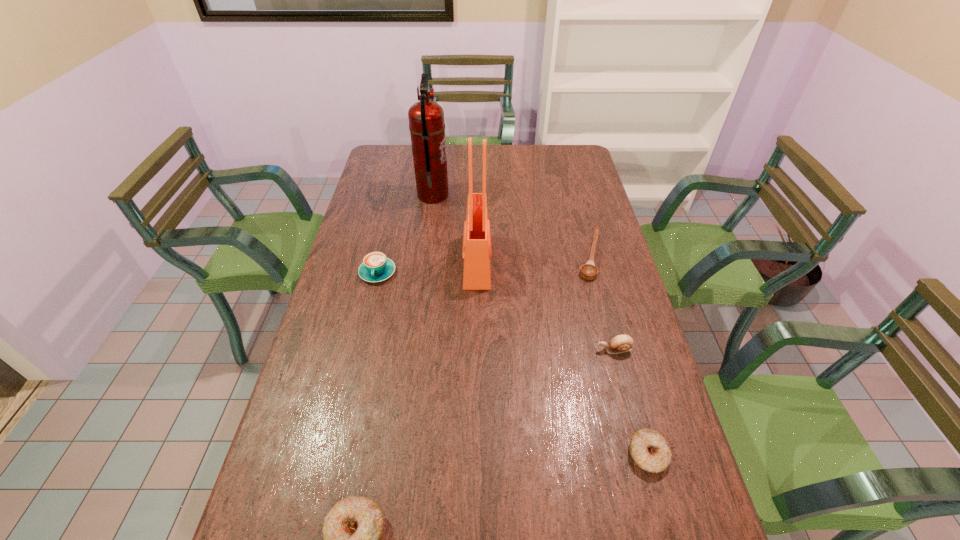
To make them evenly spaced by inserting another doughnut among them, please locate a vacant spot for this new doughnut. Please provide its 2D coordinates. Your answer should be formatted as a tuple, i.e. [(x, y)], where the tuple contains the x and y coordinates of a point satisfying the conditions above.

[(511, 490)]